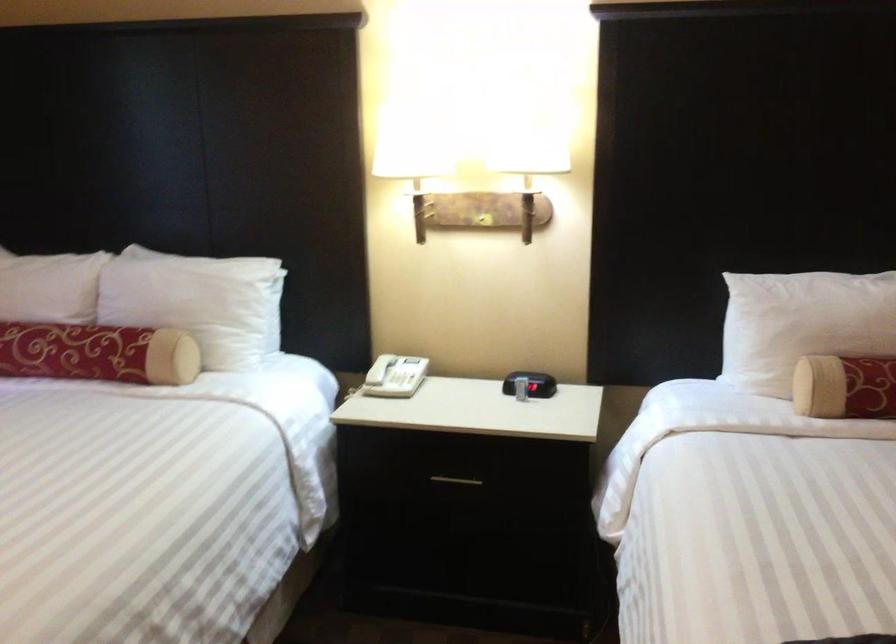
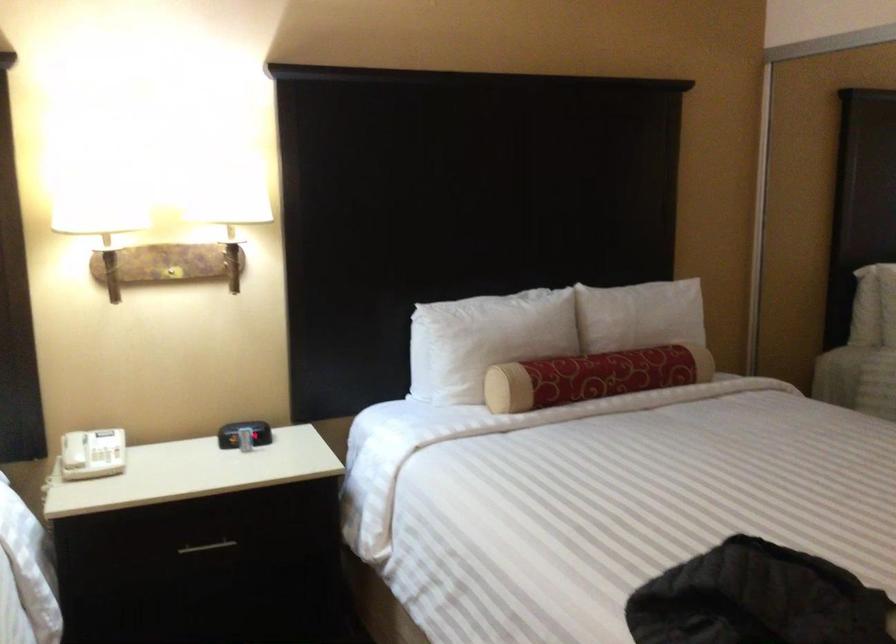
Find the pixel in the second image that matches the point at 458,480 in the first image.

(207, 547)